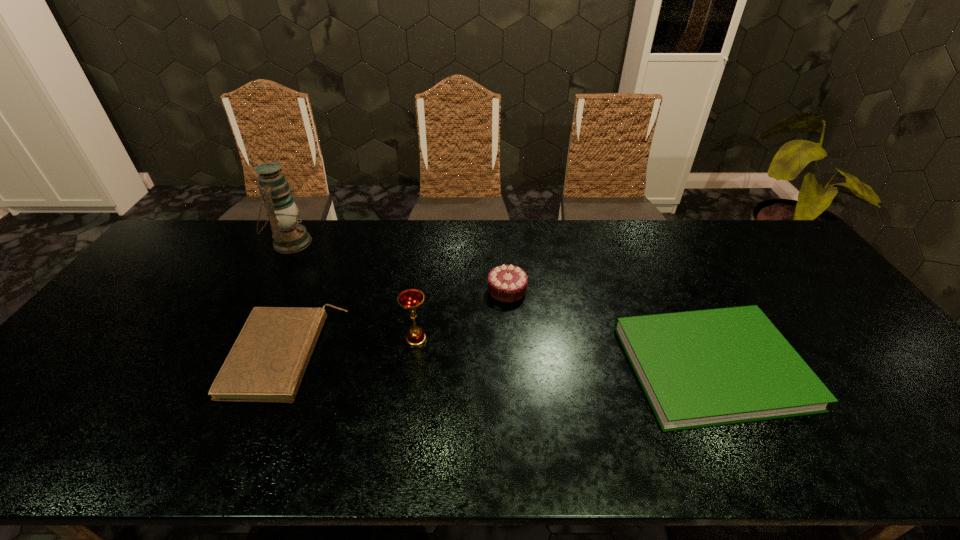
The height and width of the screenshot is (540, 960). What are the coordinates of `vacant space situated on the left of the fourth object from left to right` in the screenshot? It's located at (368, 290).

You are a GUI agent. You are given a task and a screenshot of the screen. Output one action in this format:
    pyautogui.click(x=<x>, y=<y>)
    Task: Click on the blank space located 0.270m on the spine side of the left paperback book
    
    Given the screenshot: What is the action you would take?
    pyautogui.click(x=444, y=355)

The image size is (960, 540). In order to click on vacant area situated 0.360m on the left of the rightmost object in this screenshot , I will do `click(483, 366)`.

Find the location of a particular element. object that is at the far edge is located at coordinates (288, 236).

You are a GUI agent. You are given a task and a screenshot of the screen. Output one action in this format:
    pyautogui.click(x=<x>, y=<y>)
    Task: Click on the object that is positioned at the near edge
    The image size is (960, 540).
    Given the screenshot: What is the action you would take?
    click(704, 368)

Find the location of a particular element. The image size is (960, 540). vacant area at the far edge is located at coordinates (367, 220).

This screenshot has height=540, width=960. Find the location of `free region at the near edge of the desktop`. free region at the near edge of the desktop is located at coordinates (738, 457).

At what (x,y) coordinates should I click in order to perform the action: click on vacant space at the left edge. Please return your answer as a coordinate pair (x, y). This screenshot has width=960, height=540. Looking at the image, I should click on (180, 264).

In the image, there is a desktop. Where is `vacant space at the right edge`? vacant space at the right edge is located at coordinates (779, 287).

Where is `free space at the far left corner of the desktop`? Image resolution: width=960 pixels, height=540 pixels. free space at the far left corner of the desktop is located at coordinates (201, 233).